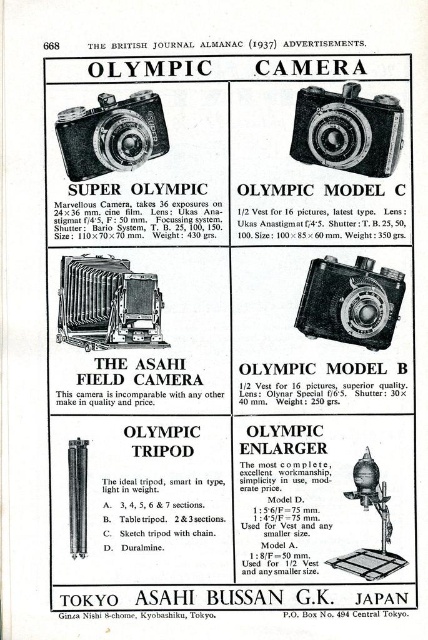
You are a photographer setting up equipment for a photo shoot. You have a matte black camera at center and a viewer. How far apart should you place them to ensure proper alignment for the shoot?

The matte black camera at center and viewer should be placed 1.17 meters apart to ensure proper alignment for the shoot.

Based on the scene description from the 1937 Olympic Camera advertisement, where is the matte black camera at upper left located in the image?

The matte black camera at upper left is located at point (x=112, y=134).